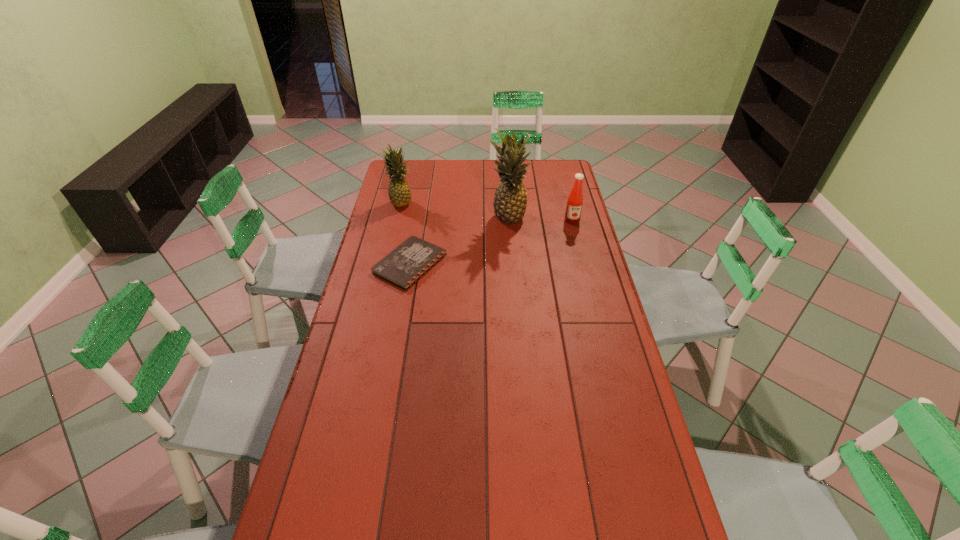
The height and width of the screenshot is (540, 960). Find the location of `object that stands as the second closest to the rightmost object`. object that stands as the second closest to the rightmost object is located at coordinates (411, 260).

Where is `the closest object to the condiment`? This screenshot has height=540, width=960. the closest object to the condiment is located at coordinates (510, 200).

Locate an element on the screen. This screenshot has width=960, height=540. free space that satisfies the following two spatial constraints: 1. on the front side of the third shortest object; 2. on the left side of the notebook is located at coordinates (386, 264).